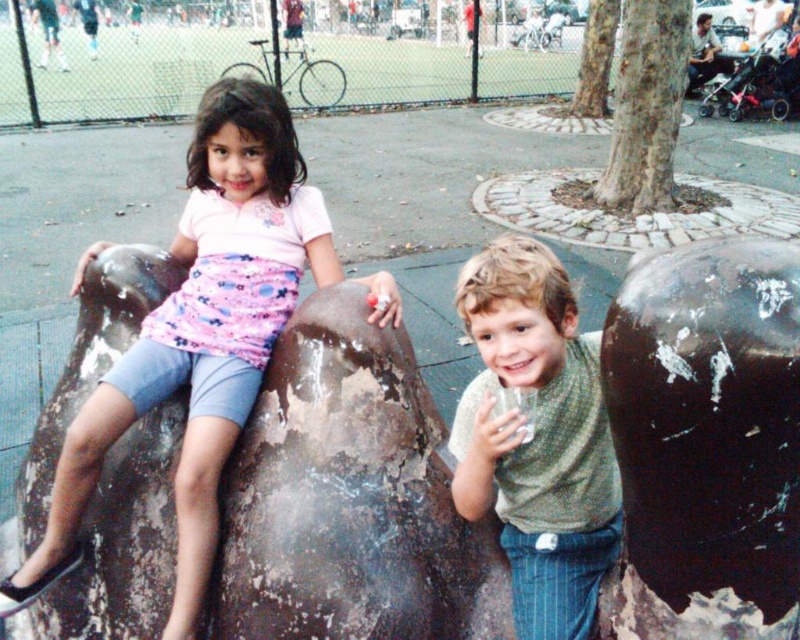
Between point (637, 324) and point (541, 492), which one is positioned in front?

Point (637, 324)

Is rusty metal sculpture at lower right to the left of green textured shirt at center from the viewer's perspective?

In fact, rusty metal sculpture at lower right is to the right of green textured shirt at center.

Is point (672, 358) farther from viewer compared to point (480, 403)?

No, it is in front of (480, 403).

Find the location of a particular element. rusty metal sculpture at lower right is located at coordinates (706, 442).

Image resolution: width=800 pixels, height=640 pixels. What do you see at coordinates (200, 332) in the screenshot? I see `matte pink shirt at upper left` at bounding box center [200, 332].

Between matte pink shirt at upper left and green textured shirt at center, which one is positioned higher?

matte pink shirt at upper left is above.

Does point (165, 324) lie in front of point (494, 253)?

No, it is behind (494, 253).

Locate an element on the screen. This screenshot has width=800, height=640. matte pink shirt at upper left is located at coordinates (200, 332).

The width and height of the screenshot is (800, 640). What are the coordinates of `rusty metal sculpture at center` in the screenshot? It's located at (348, 499).

Is rusty metal sculpture at center to the right of matte pink shirt at upper left from the viewer's perspective?

Correct, you'll find rusty metal sculpture at center to the right of matte pink shirt at upper left.

Is point (390, 596) closer to viewer compared to point (192, 368)?

Yes, it is in front of point (192, 368).

Locate an element on the screen. Image resolution: width=800 pixels, height=640 pixels. rusty metal sculpture at center is located at coordinates (348, 499).